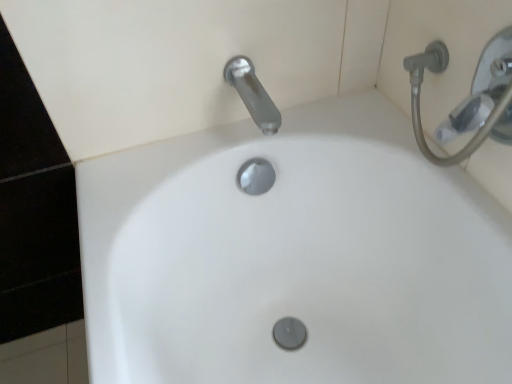
Where is `white glossy sink at center`? white glossy sink at center is located at coordinates (294, 257).

Measure the distance between silver metallic shower head at upper right and camera.

They are 59.45 centimeters apart.

The height and width of the screenshot is (384, 512). In order to click on satin nickel faucet at upper center in this screenshot , I will do `click(252, 94)`.

What do you see at coordinates (252, 94) in the screenshot? I see `satin nickel faucet at upper center` at bounding box center [252, 94].

Identify the location of white glossy sink at center. (294, 257).

Does satin nickel faucet at upper center have a greater width compared to silver metallic shower head at upper right?

Yes, satin nickel faucet at upper center is wider than silver metallic shower head at upper right.

Visually, is satin nickel faucet at upper center positioned to the left or to the right of silver metallic shower head at upper right?

Based on their positions, satin nickel faucet at upper center is located to the left of silver metallic shower head at upper right.

Between satin nickel faucet at upper center and silver metallic shower head at upper right, which one is positioned behind?

Positioned behind is satin nickel faucet at upper center.

Locate an element on the screen. The image size is (512, 384). tap behind the silver metallic shower head at upper right is located at coordinates (252, 94).

From a real-world perspective, is white glossy sink at center over satin nickel faucet at upper center?

No, from a real-world perspective, white glossy sink at center is not over satin nickel faucet at upper center

Does white glossy sink at center have a greater width compared to satin nickel faucet at upper center?

Indeed, white glossy sink at center has a greater width compared to satin nickel faucet at upper center.

In terms of height, does white glossy sink at center look taller or shorter compared to satin nickel faucet at upper center?

In the image, white glossy sink at center appears to be taller than satin nickel faucet at upper center.

Which point is more distant from viewer, (257,369) or (263,92)?

The point (257,369) is farther.

Which is correct: silver metallic shower head at upper right is inside white glossy sink at center, or outside of it?

The correct answer is: outside.

Can you confirm if silver metallic shower head at upper right is taller than white glossy sink at center?

No.

Is silver metallic shower head at upper right far away from white glossy sink at center?

silver metallic shower head at upper right is near white glossy sink at center, not far away.

Locate an element on the screen. The width and height of the screenshot is (512, 384). shower on the right of white glossy sink at center is located at coordinates tap(468, 97).

From a real-world perspective, which is physically below, satin nickel faucet at upper center or white glossy sink at center?

white glossy sink at center, from a real-world perspective.

Between point (244, 86) and point (87, 309), which one is positioned behind?

The point (244, 86) is more distant.

Is satin nickel faucet at upper center looking in the opposite direction of white glossy sink at center?

No, satin nickel faucet at upper center is not facing the opposite direction of white glossy sink at center.

Visually, is silver metallic shower head at upper right positioned to the left or to the right of satin nickel faucet at upper center?

From the image, it's evident that silver metallic shower head at upper right is to the right of satin nickel faucet at upper center.

Are silver metallic shower head at upper right and satin nickel faucet at upper center located far from each other?

silver metallic shower head at upper right is actually quite close to satin nickel faucet at upper center.

From a real-world perspective, which is physically above, silver metallic shower head at upper right or satin nickel faucet at upper center?

From a 3D spatial view, silver metallic shower head at upper right is above.

Can you confirm if silver metallic shower head at upper right is taller than satin nickel faucet at upper center?

Correct, silver metallic shower head at upper right is much taller as satin nickel faucet at upper center.

Is white glossy sink at center further to the viewer compared to silver metallic shower head at upper right?

No, white glossy sink at center is in front of silver metallic shower head at upper right.

Is white glossy sink at center positioned beyond the bounds of silver metallic shower head at upper right?

Yes.

In terms of width, does white glossy sink at center look wider or thinner when compared to silver metallic shower head at upper right?

Considering their sizes, white glossy sink at center looks broader than silver metallic shower head at upper right.

From a real-world perspective, is white glossy sink at center on top of silver metallic shower head at upper right?

No.

The height and width of the screenshot is (384, 512). Identify the location of tap above the silver metallic shower head at upper right (from the image's perspective). coord(252,94).

Identify the location of sink that appears below the satin nickel faucet at upper center (from the image's perspective). This screenshot has height=384, width=512. (294, 257).

Based on their spatial positions, is white glossy sink at center or silver metallic shower head at upper right closer to satin nickel faucet at upper center?

silver metallic shower head at upper right.

Considering their positions, is satin nickel faucet at upper center positioned further to silver metallic shower head at upper right than white glossy sink at center?

white glossy sink at center lies further to silver metallic shower head at upper right than the other object.

Looking at the image, which one is located closer to silver metallic shower head at upper right, white glossy sink at center or satin nickel faucet at upper center?

satin nickel faucet at upper center is positioned closer to the anchor silver metallic shower head at upper right.

Consider the image. Considering their positions, is silver metallic shower head at upper right positioned closer to white glossy sink at center than satin nickel faucet at upper center?

satin nickel faucet at upper center lies closer to white glossy sink at center than the other object.

From the image, which object appears to be nearer to satin nickel faucet at upper center, silver metallic shower head at upper right or white glossy sink at center?

silver metallic shower head at upper right.

Looking at the image, which one is located closer to white glossy sink at center, satin nickel faucet at upper center or silver metallic shower head at upper right?

satin nickel faucet at upper center is closer to white glossy sink at center.

Locate an element on the screen. shower between satin nickel faucet at upper center and white glossy sink at center from top to bottom is located at coordinates (468, 97).